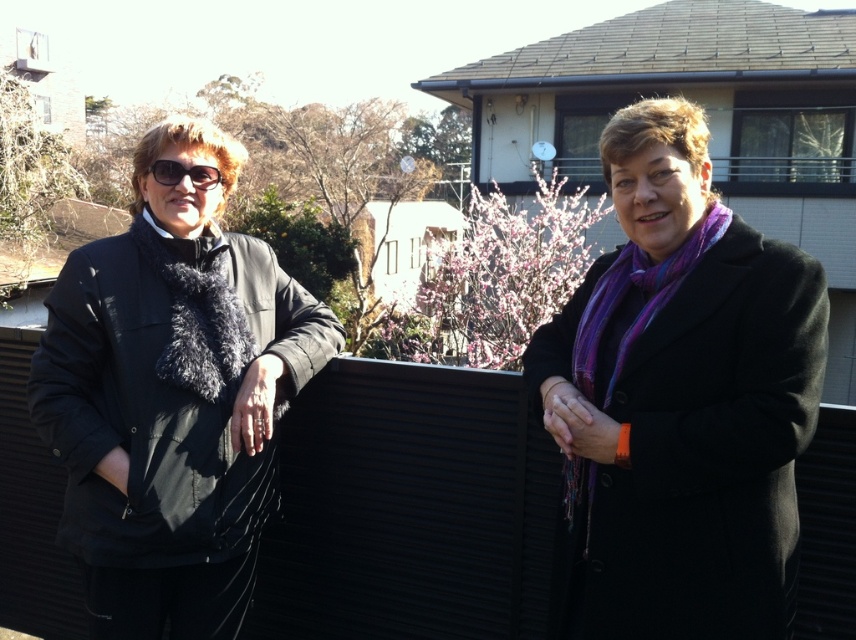
Consider the image. You are a photographer trying to capture a portrait of the two people in the scene. You want to ensure that both the purple wool scarf at center and the black matte sunglasses at left are clearly visible in the frame. Based on their positions, which object should you focus on first to ensure both are in focus?

The black matte sunglasses at left should be focused on first because the purple wool scarf at center is located below it, so adjusting focus starting from the higher object ensures both are in the frame.

You are a fashion designer observing two scarves in the image. The purple wool scarf at center and the black fuzzy scarf at left are part of your collection. You need to decide if they can be displayed side by side in a store window that has a shelf 3 feet wide. Can both scarves fit on the shelf without overlapping?

The purple wool scarf at center and black fuzzy scarf at left are 3.43 feet apart, which means the total width required for both would be more than 3 feet. Therefore, they cannot fit side by side on the 3 feet wide shelf without overlapping.

You are a fashion designer observing two scarves in an image. The scene shows a residential area with two people. The first person is leaning against a black fence and wearing a dark jacket with a scarf. The second person is standing near them, wearing a dark coat and a scarf. You need to determine which scarf is shorter between the purple wool scarf at center and the black fuzzy scarf at left. Which one is shorter?

The purple wool scarf at center is shorter than the black fuzzy scarf at left according to the description.